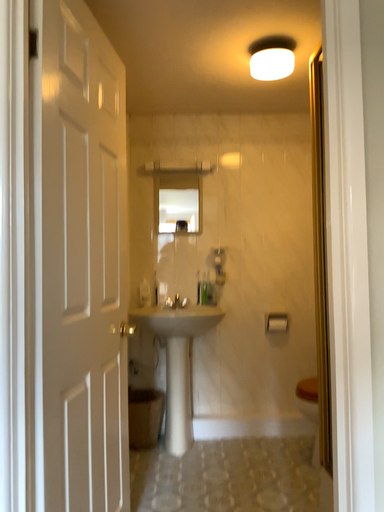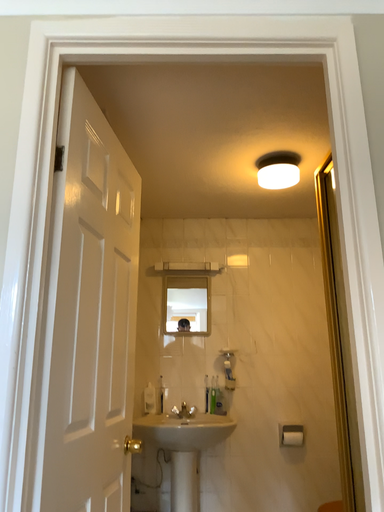
Question: Which way did the camera rotate in the video?

Choices:
 (A) rotated downward
 (B) rotated upward

Answer: (B)